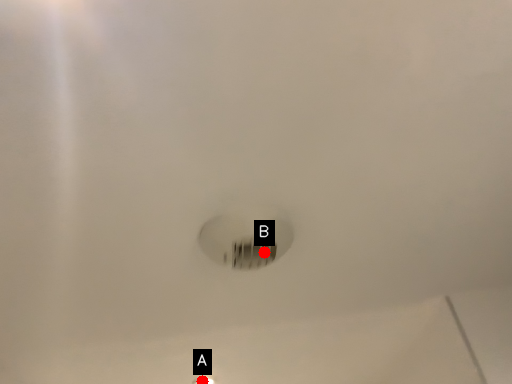
Question: Two points are circled on the image, labeled by A and B beside each circle. Which of the following is the closest to the observer?

Choices:
 (A) A is closer
 (B) B is closer

Answer: (B)